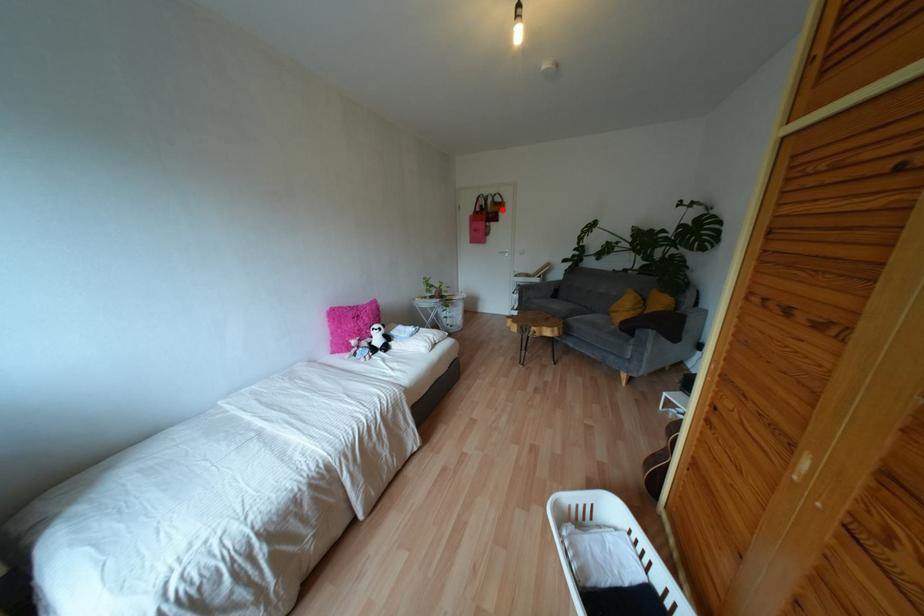
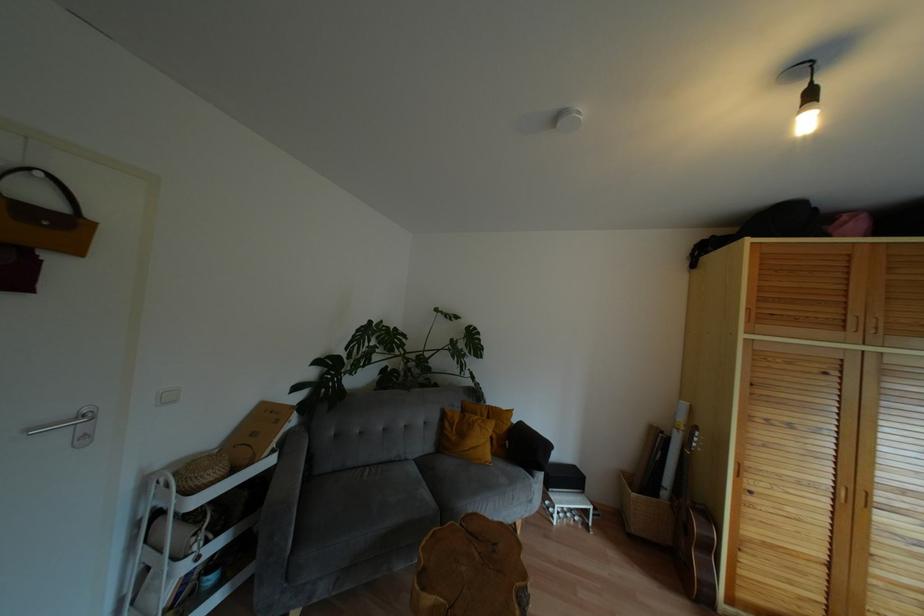
Find the pixel in the second image that matches the highlighted location in the first image.

(78, 251)